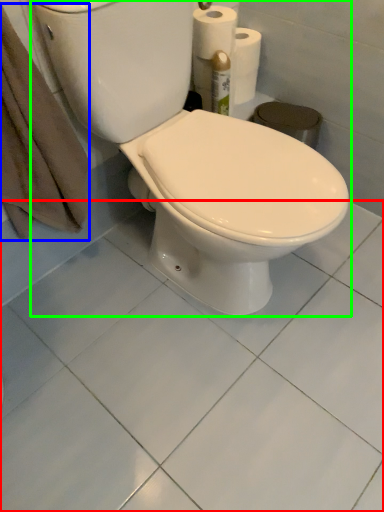
Question: Based on their relative distances, which object is farther from ceramic tile (highlighted by a red box)? Choose from bath towel (highlighted by a blue box) and toilet (highlighted by a green box).

Choices:
 (A) bath towel
 (B) toilet

Answer: (A)